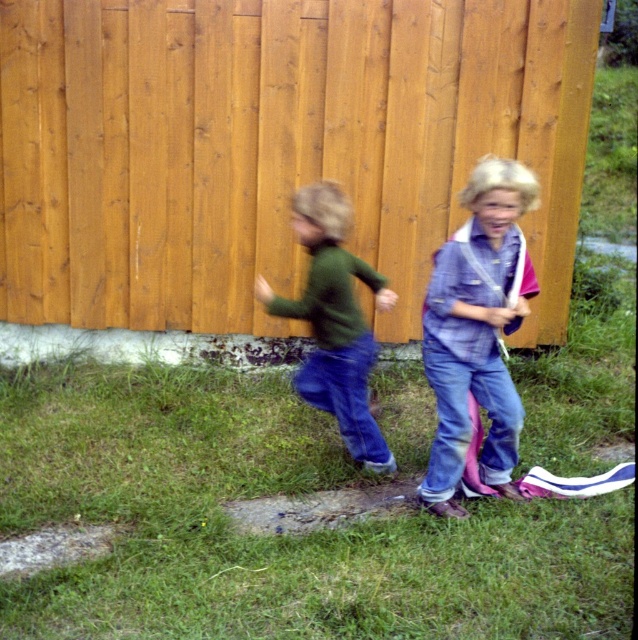
You are a photographer trying to capture a candid shot of the children playing near the wooden fence. You want to position yourself so that the wooden fence at center and the green matte shirt at center are both visible in the frame. Based on their positions, which object should be placed on the left side of your camera frame?

The wooden fence at center is to the left of the green matte shirt at center, so you should place the wooden fence at center on the left side of your camera frame to capture both objects in the shot.

You are a painter who wants to paint the wooden fence at center and the denim jeans at right. If you have enough paint to cover 10 square meters, which object requires more paint based on their widths?

The wooden fence at center requires more paint because its width is larger than the denim jeans at right.